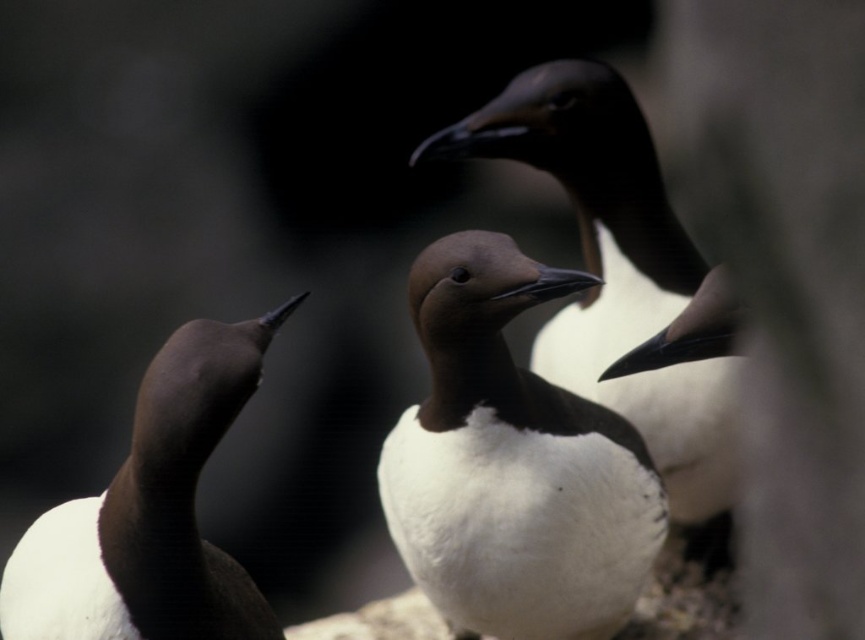
Is point (556, 531) less distant than point (133, 592)?

No, (556, 531) is further to viewer.

Consider the image. Is white matte penguin at center shorter than brown matte penguin at left?

No, white matte penguin at center is not shorter than brown matte penguin at left.

Who is more distant from viewer, (569, 548) or (39, 564)?

The point (569, 548) is behind.

The image size is (865, 640). What are the coordinates of `white matte penguin at center` in the screenshot? It's located at (511, 464).

Is white matte penguin at center in front of brown matte bird at center?

Yes.

Is white matte penguin at center above brown matte bird at center?

Actually, white matte penguin at center is below brown matte bird at center.

Which is in front, point (457, 252) or point (541, 364)?

Point (457, 252) is more forward.

I want to click on white matte penguin at center, so click(x=511, y=464).

The height and width of the screenshot is (640, 865). What are the coordinates of `brown matte bird at center` in the screenshot? It's located at (620, 282).

How far apart are brown matte bird at center and brown matte penguin at left?

A distance of 90.43 centimeters exists between brown matte bird at center and brown matte penguin at left.

Between point (723, 552) and point (162, 404), which one is positioned behind?

The point (723, 552) is more distant.

Image resolution: width=865 pixels, height=640 pixels. Find the location of `brown matte bird at center`. brown matte bird at center is located at coordinates (620, 282).